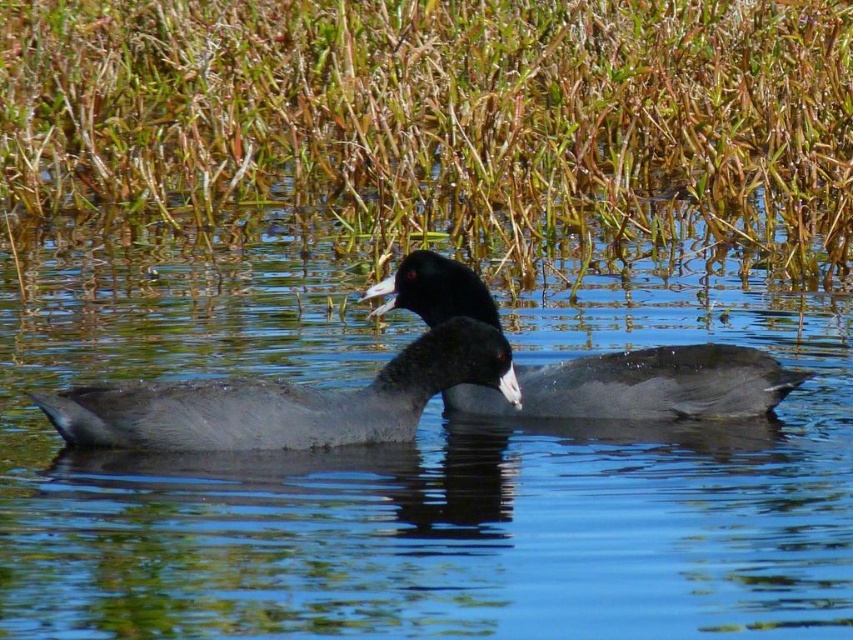
You are a birdwatcher observing two ducks in the water. You notice the gray matte duck at center and the matte gray duck at center. Which one is closer to you?

The gray matte duck at center is closer to you because it is positioned in front of the matte gray duck at center.

You are a wildlife photographer trying to capture a photo of the gray matte duck at center and the matte gray duck at center. Which one should you focus on if you want to photograph the taller bird?

The gray matte duck at center is much taller than the matte gray duck at center, so you should focus on the gray matte duck at center to photograph the taller bird.